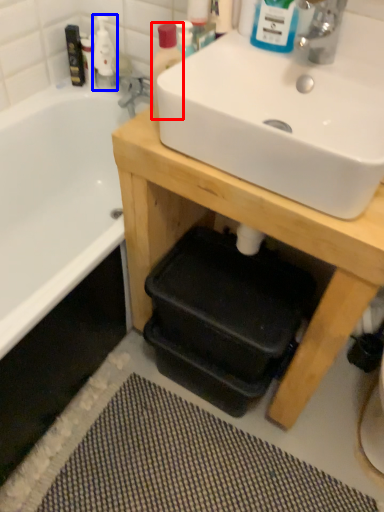
Question: Which object is closer to the camera taking this photo, bottle (highlighted by a red box) or cleaning product (highlighted by a blue box)?

Choices:
 (A) bottle
 (B) cleaning product

Answer: (A)